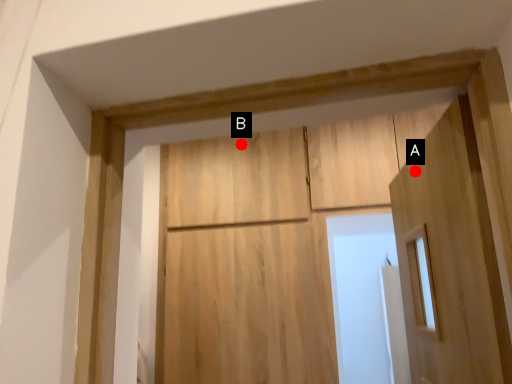
Question: Two points are circled on the image, labeled by A and B beside each circle. Which of the following is the farthest from the observer?

Choices:
 (A) A is further
 (B) B is further

Answer: (B)